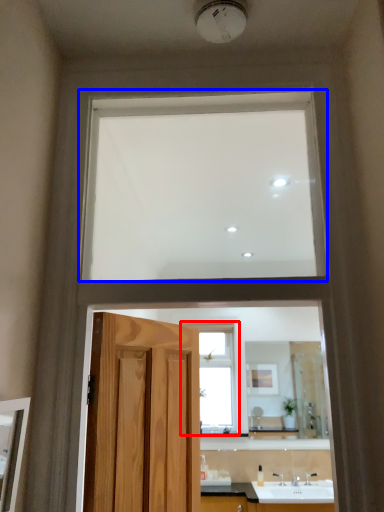
Question: Which of the following is the closest to the observer, window (highlighted by a red box) or window (highlighted by a blue box)?

Choices:
 (A) window
 (B) window

Answer: (B)